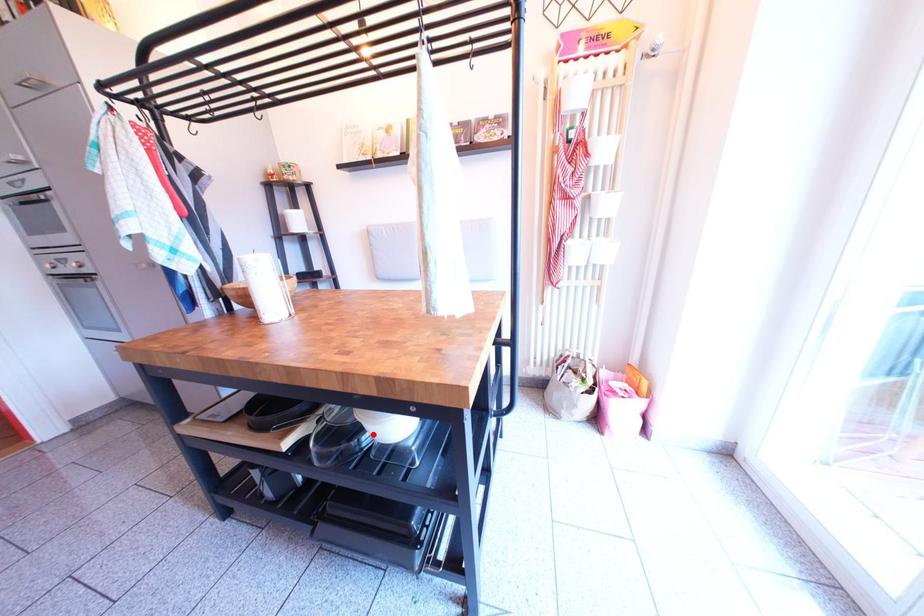
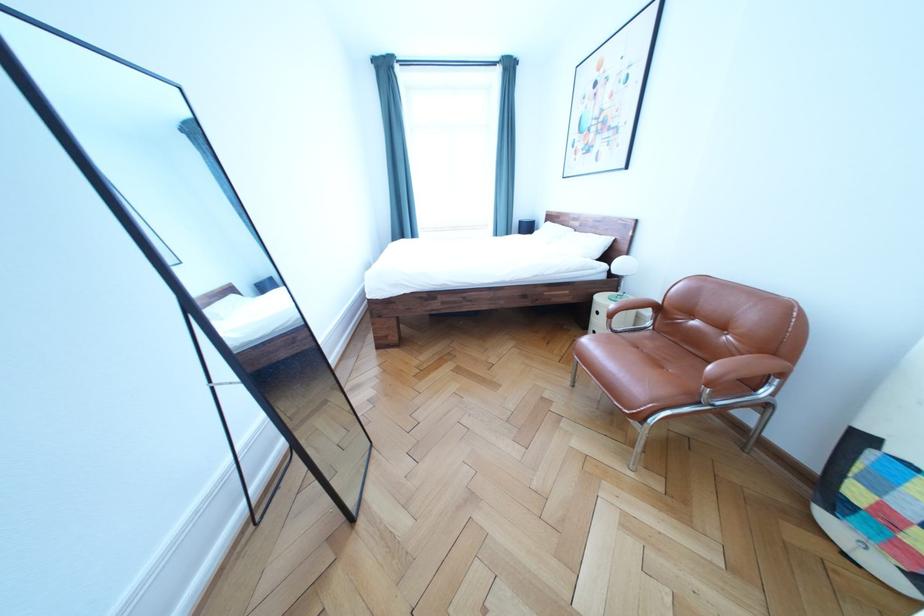
Question: I am providing you with two images of the same scene from different viewpoints. A red point is marked on the first image. Is the red point's position out of view in image 2?

Choices:
 (A) Yes
 (B) No

Answer: (A)